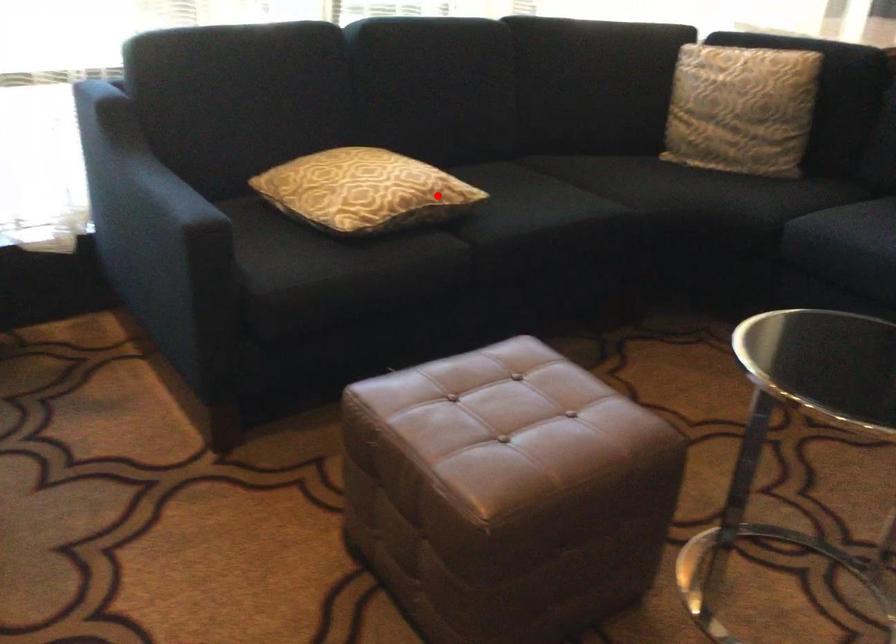
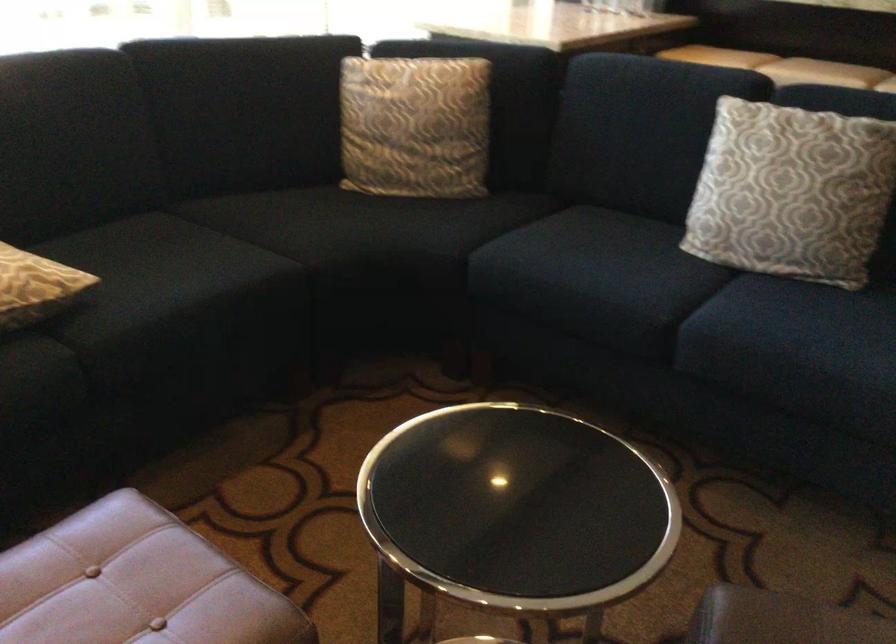
Question: I am providing you with two images of the same scene from different viewpoints. In image1, a red point is highlighted. Considering the same 3D point in image2, which of the following is correct?

Choices:
 (A) It is closer
 (B) It is farther

Answer: (A)